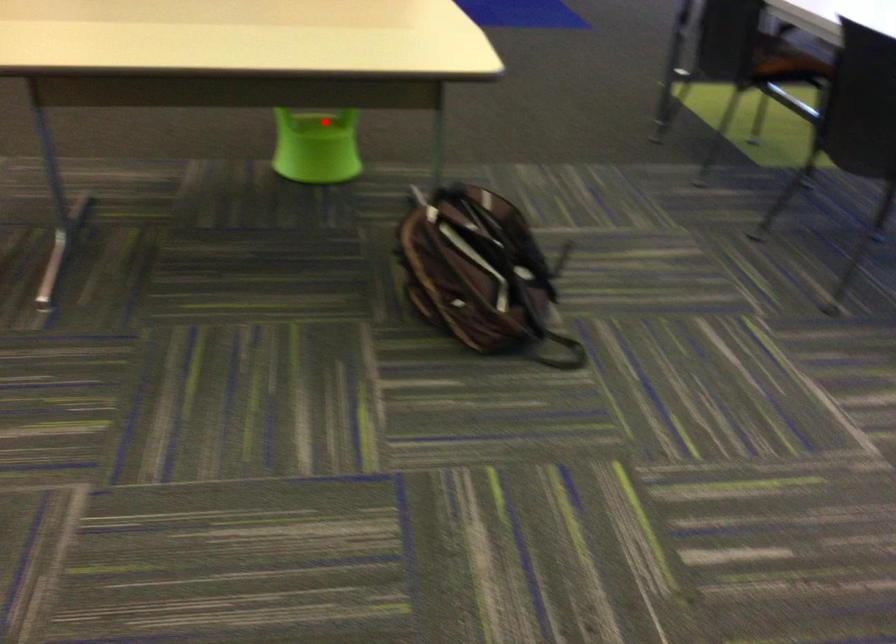
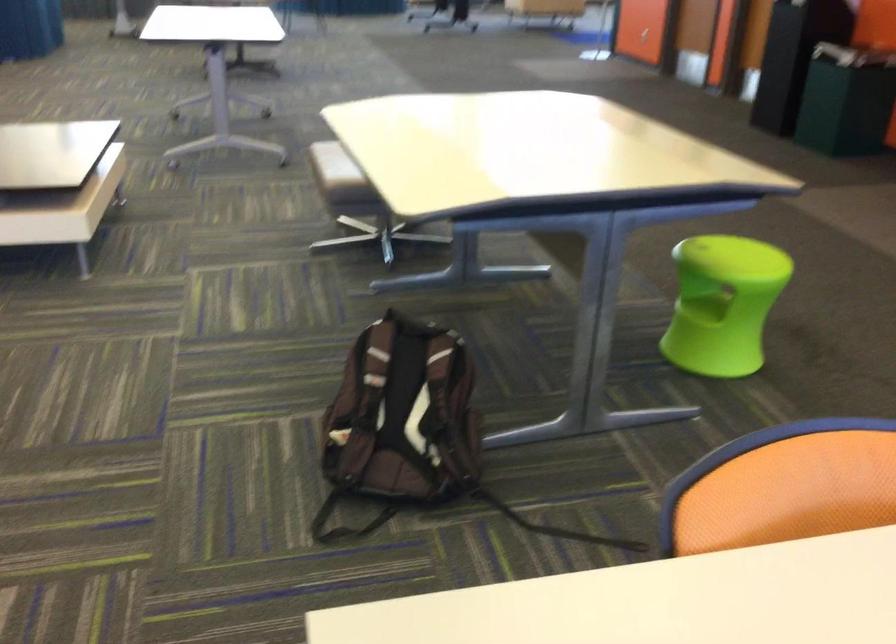
Question: I am providing you with two images of the same scene from different viewpoints. Given a red point in image1, look at the same physical point in image2. Is it:

Choices:
 (A) Closer to the viewpoint
 (B) Farther from the viewpoint

Answer: (A)